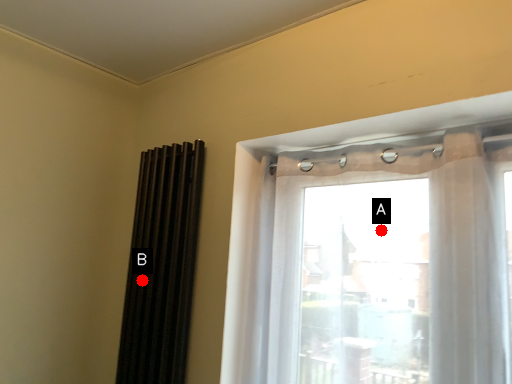
Question: Two points are circled on the image, labeled by A and B beside each circle. Among these points, which one is nearest to the camera?

Choices:
 (A) A is closer
 (B) B is closer

Answer: (A)